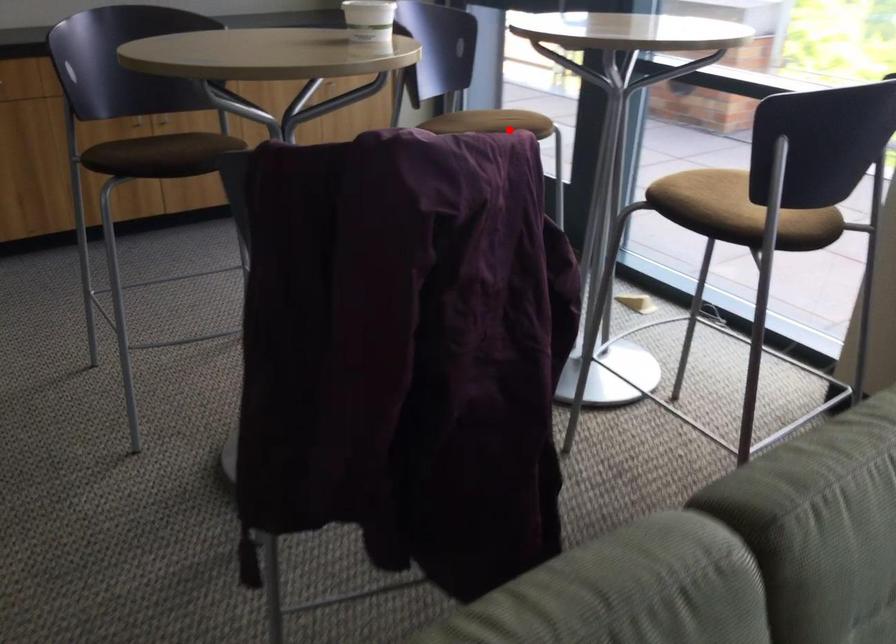
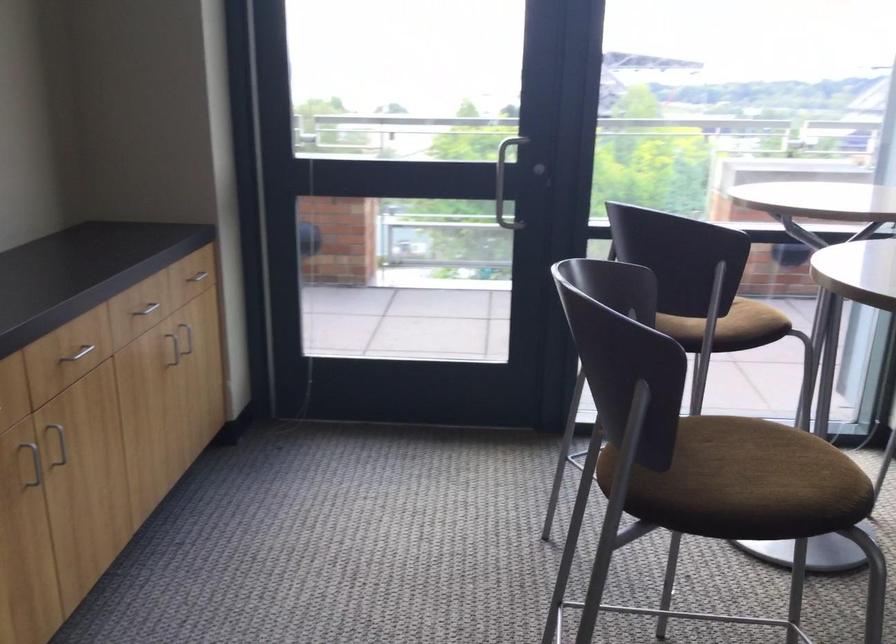
Question: I am providing you with two images of the same scene from different viewpoints. A red point is marked on the first image. At the location where the point appears in image 1, is it still visible in image 2?

Choices:
 (A) Yes
 (B) No

Answer: (A)